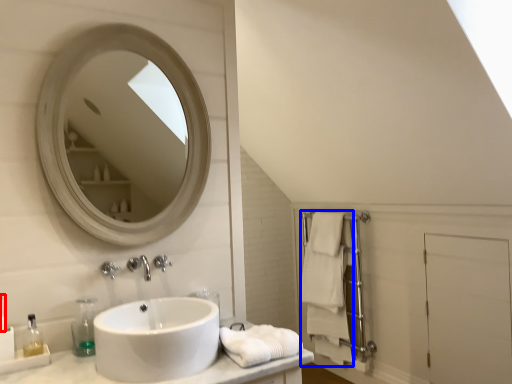
Question: Which object is closer to the camera taking this photo, toiletry (highlighted by a red box) or bath towel (highlighted by a blue box)?

Choices:
 (A) toiletry
 (B) bath towel

Answer: (A)